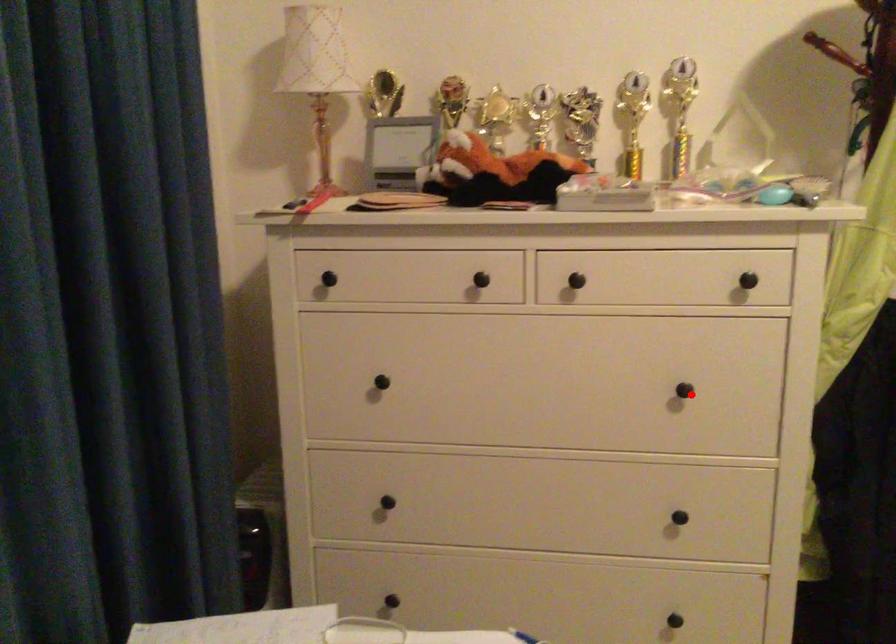
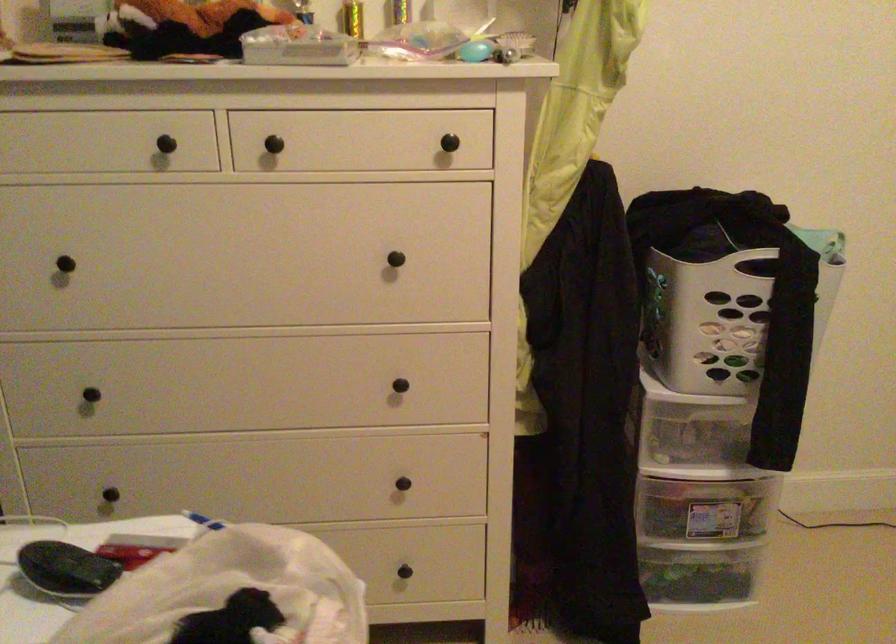
Find the pixel in the second image that matches the highlighted location in the first image.

(400, 261)